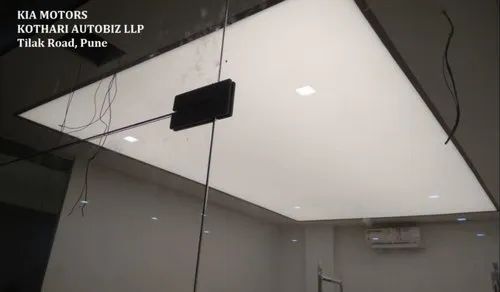
I want to click on panel light, so click(x=313, y=133).